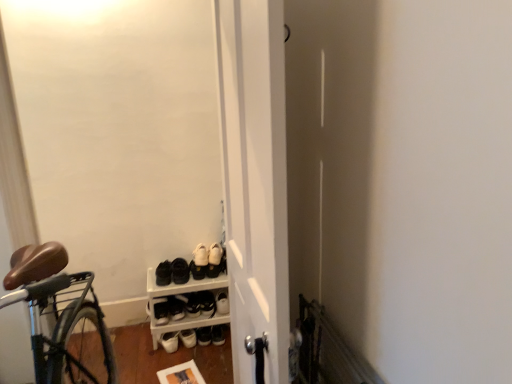
What is the approximate height of white suede shoes at lower center, the third footwear from the right?

Result: It is 4.41 inches.

The height and width of the screenshot is (384, 512). Describe the element at coordinates (199, 262) in the screenshot. I see `white suede shoes at lower center, the third footwear from the right` at that location.

The image size is (512, 384). What are the coordinates of `white suede shoes at center, which appears as the first footwear when viewed from the right` in the screenshot? It's located at (216, 260).

This screenshot has height=384, width=512. Describe the element at coordinates (180, 271) in the screenshot. I see `black matte shoes at center, the 4th footwear in the right-to-left sequence` at that location.

Image resolution: width=512 pixels, height=384 pixels. I want to click on black matte sneakers at lower left, which is counted as the 1th footwear, starting from the left, so click(x=163, y=273).

Is metallic silver radiator at lower right with white suede shoes at lower center, marked as the 3th footwear in a left-to-right arrangement?

No, metallic silver radiator at lower right is not in contact with white suede shoes at lower center, marked as the 3th footwear in a left-to-right arrangement.

From a real-world perspective, relative to white suede shoes at lower center, marked as the 3th footwear in a left-to-right arrangement, is metallic silver radiator at lower right vertically above or below?

From a real-world perspective, metallic silver radiator at lower right is physically above white suede shoes at lower center, marked as the 3th footwear in a left-to-right arrangement.

Looking at this image, is metallic silver radiator at lower right turned away from white suede shoes at lower center, the third footwear from the right?

metallic silver radiator at lower right does not have its back to white suede shoes at lower center, the third footwear from the right.

Is metallic silver radiator at lower right inside the boundaries of white suede shoes at lower center, marked as the 3th footwear in a left-to-right arrangement, or outside?

metallic silver radiator at lower right is spatially situated outside white suede shoes at lower center, marked as the 3th footwear in a left-to-right arrangement.

Is black matte sneakers at lower left, which is counted as the 1th footwear, starting from the left, looking in the opposite direction of metallic silver radiator at lower right?

No, black matte sneakers at lower left, which is counted as the 1th footwear, starting from the left, is not facing away from metallic silver radiator at lower right.

Is black matte sneakers at lower left, which is the fifth footwear in right-to-left order, far away from metallic silver radiator at lower right?

Yes.

From the image's perspective, which one is positioned lower, black matte sneakers at lower left, which is counted as the 1th footwear, starting from the left, or metallic silver radiator at lower right?

metallic silver radiator at lower right appears lower in the image.

Looking at this image, based on their positions, is black matte shoes at center, the 4th footwear in the right-to-left sequence, located to the left or right of black leather shoe at center, which ranks as the 2th footwear in right-to-left order?

black matte shoes at center, the 4th footwear in the right-to-left sequence, is positioned on black leather shoe at center, which ranks as the 2th footwear in right-to-left order,'s left side.

Is black matte shoes at center, the 4th footwear in the right-to-left sequence, beside black leather shoe at center, which ranks as the 2th footwear in right-to-left order?

black matte shoes at center, the 4th footwear in the right-to-left sequence, and black leather shoe at center, which ranks as the 2th footwear in right-to-left order, are clearly separated.

Considering the relative sizes of black leather shoe at center, arranged as the 4th footwear when viewed from the left, and white plastic shoe rack at lower center in the image provided, is black leather shoe at center, arranged as the 4th footwear when viewed from the left, smaller than white plastic shoe rack at lower center?

Correct, black leather shoe at center, arranged as the 4th footwear when viewed from the left, occupies less space than white plastic shoe rack at lower center.

This screenshot has height=384, width=512. I want to click on shelf located in front of the black leather shoe at center, which ranks as the 2th footwear in right-to-left order, so click(x=183, y=293).

From a real-world perspective, relative to white plastic shoe rack at lower center, is black leather shoe at center, which ranks as the 2th footwear in right-to-left order, vertically above or below?

Clearly, from a real-world perspective, black leather shoe at center, which ranks as the 2th footwear in right-to-left order, is below white plastic shoe rack at lower center.

In the image, is black leather shoe at center, arranged as the 4th footwear when viewed from the left, on the left side or the right side of white plastic shoe rack at lower center?

black leather shoe at center, arranged as the 4th footwear when viewed from the left, is positioned on white plastic shoe rack at lower center's right side.

From a real-world perspective, relative to black leather shoe at center, which ranks as the 2th footwear in right-to-left order, is metallic silver radiator at lower right vertically above or below?

From a real-world perspective, metallic silver radiator at lower right is physically above black leather shoe at center, which ranks as the 2th footwear in right-to-left order.

Measure the distance between metallic silver radiator at lower right and black leather shoe at center, arranged as the 4th footwear when viewed from the left.

metallic silver radiator at lower right is 4.08 feet away from black leather shoe at center, arranged as the 4th footwear when viewed from the left.

From the image's perspective, which one is positioned higher, metallic silver radiator at lower right or black leather shoe at center, which ranks as the 2th footwear in right-to-left order?

From the image's view, metallic silver radiator at lower right is above.

In the image, is metallic silver radiator at lower right positioned in front of or behind black leather shoe at center, arranged as the 4th footwear when viewed from the left?

Visually, metallic silver radiator at lower right is located in front of black leather shoe at center, arranged as the 4th footwear when viewed from the left.

From the picture: Is black matte shoes at center, the 4th footwear in the right-to-left sequence, to the right of metallic silver radiator at lower right from the viewer's perspective?

Incorrect, black matte shoes at center, the 4th footwear in the right-to-left sequence, is not on the right side of metallic silver radiator at lower right.

Is black matte shoes at center, arranged as the 2th footwear when viewed from the left, positioned with its back to metallic silver radiator at lower right?

No, black matte shoes at center, arranged as the 2th footwear when viewed from the left, is not facing the opposite direction of metallic silver radiator at lower right.

Is metallic silver radiator at lower right completely or partially inside black matte shoes at center, the 4th footwear in the right-to-left sequence?

No, metallic silver radiator at lower right is not inside black matte shoes at center, the 4th footwear in the right-to-left sequence.

From the image's perspective, which object appears higher, black leather shoe at center, arranged as the 4th footwear when viewed from the left, or black matte sneakers at lower left, which is the fifth footwear in right-to-left order?

black matte sneakers at lower left, which is the fifth footwear in right-to-left order, appears higher in the image.

Does point (212, 313) come in front of point (167, 265)?

No, (212, 313) is further to viewer.

Which object is closer to the camera taking this photo, black leather shoe at center, arranged as the 4th footwear when viewed from the left, or black matte sneakers at lower left, which is counted as the 1th footwear, starting from the left?

black matte sneakers at lower left, which is counted as the 1th footwear, starting from the left, is closer to the camera.

From the image's perspective, which footwear is the 2nd one above the metallic silver radiator at lower right? Please provide its 2D coordinates.

[(199, 262)]

This screenshot has width=512, height=384. I want to click on radiator that appears above the black matte sneakers at lower left, which is counted as the 1th footwear, starting from the left (from a real-world perspective), so click(328, 351).

From the image, which object appears to be farther from white suede shoes at lower center, marked as the 3th footwear in a left-to-right arrangement, metallic silver radiator at lower right or white matte door at center?

Based on the image, white matte door at center appears to be further to white suede shoes at lower center, marked as the 3th footwear in a left-to-right arrangement.

Based on their spatial positions, is metallic silver radiator at lower right or white matte door at center further from white suede shoes at center, which appears as the first footwear when viewed from the right?

white matte door at center.

From the image, which object appears to be nearer to black leather shoe at center, arranged as the 4th footwear when viewed from the left, white matte door at center or black matte sneakers at lower left, which is counted as the 1th footwear, starting from the left?

black matte sneakers at lower left, which is counted as the 1th footwear, starting from the left.

From the image, which object appears to be nearer to black matte sneakers at lower left, which is the fifth footwear in right-to-left order, white matte door at center or white suede shoes at center, the fifth footwear from the left?

Based on the image, white suede shoes at center, the fifth footwear from the left, appears to be nearer to black matte sneakers at lower left, which is the fifth footwear in right-to-left order.

Which object lies nearer to the anchor point black matte shoes at center, the 4th footwear in the right-to-left sequence, white matte door at center or metallic silver radiator at lower right?

The object closer to black matte shoes at center, the 4th footwear in the right-to-left sequence, is metallic silver radiator at lower right.

Looking at the image, which one is located closer to black matte shoes at center, arranged as the 2th footwear when viewed from the left, white suede shoes at center, which appears as the first footwear when viewed from the right, or white plastic shoe rack at lower center?

white suede shoes at center, which appears as the first footwear when viewed from the right.

Based on their spatial positions, is white suede shoes at center, which appears as the first footwear when viewed from the right, or black leather shoe at center, arranged as the 4th footwear when viewed from the left, closer to black matte shoes at center, arranged as the 2th footwear when viewed from the left?

white suede shoes at center, which appears as the first footwear when viewed from the right, is positioned closer to the anchor black matte shoes at center, arranged as the 2th footwear when viewed from the left.

Based on their spatial positions, is black leather shoe at center, arranged as the 4th footwear when viewed from the left, or white suede shoes at center, the fifth footwear from the left, closer to black matte sneakers at lower left, which is counted as the 1th footwear, starting from the left?

Among the two, black leather shoe at center, arranged as the 4th footwear when viewed from the left, is located nearer to black matte sneakers at lower left, which is counted as the 1th footwear, starting from the left.

The width and height of the screenshot is (512, 384). What are the coordinates of `shelf between white matte door at center and black matte sneakers at lower left, which is counted as the 1th footwear, starting from the left, in the front-back direction` in the screenshot? It's located at (183, 293).

Where is `shelf located between metallic silver radiator at lower right and black matte shoes at center, arranged as the 2th footwear when viewed from the left, in the depth direction`? shelf located between metallic silver radiator at lower right and black matte shoes at center, arranged as the 2th footwear when viewed from the left, in the depth direction is located at coordinates (183, 293).

You are a GUI agent. You are given a task and a screenshot of the screen. Output one action in this format:
    pyautogui.click(x=<x>, y=<y>)
    Task: Click on the shelf between metallic silver radiator at lower right and black matte sneakers at lower left, which is counted as the 1th footwear, starting from the left, from front to back
    This screenshot has height=384, width=512.
    Given the screenshot: What is the action you would take?
    pyautogui.click(x=183, y=293)

Find the location of a particular element. The image size is (512, 384). shelf between metallic silver radiator at lower right and white suede shoes at lower center, the third footwear from the right, along the z-axis is located at coordinates (183, 293).